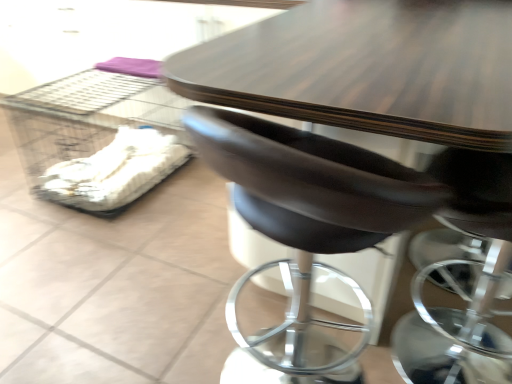
The width and height of the screenshot is (512, 384). What are the coordinates of `clear plastic crate at left` in the screenshot? It's located at (98, 136).

Describe the element at coordinates (98, 136) in the screenshot. I see `clear plastic crate at left` at that location.

Image resolution: width=512 pixels, height=384 pixels. What do you see at coordinates (306, 231) in the screenshot?
I see `brown leather chair at center` at bounding box center [306, 231].

The width and height of the screenshot is (512, 384). I want to click on brown leather chair at center, so click(x=306, y=231).

This screenshot has width=512, height=384. Identify the location of clear plastic crate at left. (98, 136).

Is clear plastic crate at left at the right side of brown leather chair at center?

No.

In the image, is clear plastic crate at left positioned in front of or behind brown leather chair at center?

In the image, clear plastic crate at left appears behind brown leather chair at center.

Is point (172, 99) more distant than point (350, 351)?

Yes, it is behind point (350, 351).

From the image's perspective, which one is positioned lower, clear plastic crate at left or brown leather chair at center?

brown leather chair at center.

From a real-world perspective, who is located lower, clear plastic crate at left or brown leather chair at center?

clear plastic crate at left is physically lower.

Considering the sizes of clear plastic crate at left and brown leather chair at center in the image, is clear plastic crate at left wider or thinner than brown leather chair at center?

clear plastic crate at left is wider than brown leather chair at center.

From the picture: In terms of height, does clear plastic crate at left look taller or shorter compared to brown leather chair at center?

In the image, clear plastic crate at left appears to be shorter than brown leather chair at center.

Considering the relative sizes of clear plastic crate at left and brown leather chair at center in the image provided, is clear plastic crate at left smaller than brown leather chair at center?

Correct, clear plastic crate at left occupies less space than brown leather chair at center.

Is brown leather chair at center inside clear plastic crate at left?

No.

Are clear plastic crate at left and brown leather chair at center far apart?

Absolutely, clear plastic crate at left is distant from brown leather chair at center.

Is clear plastic crate at left oriented towards brown leather chair at center?

Yes, clear plastic crate at left faces towards brown leather chair at center.

Based on the photo, what's the angular difference between clear plastic crate at left and brown leather chair at center's facing directions?

clear plastic crate at left and brown leather chair at center are facing 88.9 degrees away from each other.

In order to click on chair in front of the clear plastic crate at left in this screenshot , I will do `click(306, 231)`.

Considering the relative positions of brown leather chair at center and clear plastic crate at left in the image provided, is brown leather chair at center to the left or to the right of clear plastic crate at left?

Clearly, brown leather chair at center is on the right of clear plastic crate at left in the image.

Considering the relative positions of brown leather chair at center and clear plastic crate at left in the image provided, is brown leather chair at center behind clear plastic crate at left?

No, it is not.

Is point (355, 377) less distant than point (170, 163)?

Yes.

From the image's perspective, is brown leather chair at center beneath clear plastic crate at left?

Yes, from the image's perspective, brown leather chair at center is beneath clear plastic crate at left.

From a real-world perspective, is brown leather chair at center positioned over clear plastic crate at left based on gravity?

Correct, in the physical world, brown leather chair at center is higher than clear plastic crate at left.

Considering the sizes of objects brown leather chair at center and clear plastic crate at left in the image provided, who is thinner, brown leather chair at center or clear plastic crate at left?

brown leather chair at center.

Which of these two, brown leather chair at center or clear plastic crate at left, stands taller?

brown leather chair at center.

Considering the sizes of objects brown leather chair at center and clear plastic crate at left in the image provided, who is bigger, brown leather chair at center or clear plastic crate at left?

brown leather chair at center is bigger.

Is brown leather chair at center not inside clear plastic crate at left?

Indeed, brown leather chair at center is completely outside clear plastic crate at left.

In the scene shown: Are brown leather chair at center and clear plastic crate at left located far from each other?

brown leather chair at center is far away from clear plastic crate at left.

Is brown leather chair at center oriented away from clear plastic crate at left?

No.

Can you tell me how much brown leather chair at center and clear plastic crate at left differ in facing direction?

They differ by 88.9 degrees in their facing directions.

Identify the location of chair below the clear plastic crate at left (from the image's perspective). Image resolution: width=512 pixels, height=384 pixels. (306, 231).

Locate an element on the screen. crate below the brown leather chair at center (from a real-world perspective) is located at coordinates (98, 136).

I want to click on chair below the clear plastic crate at left (from the image's perspective), so click(306, 231).